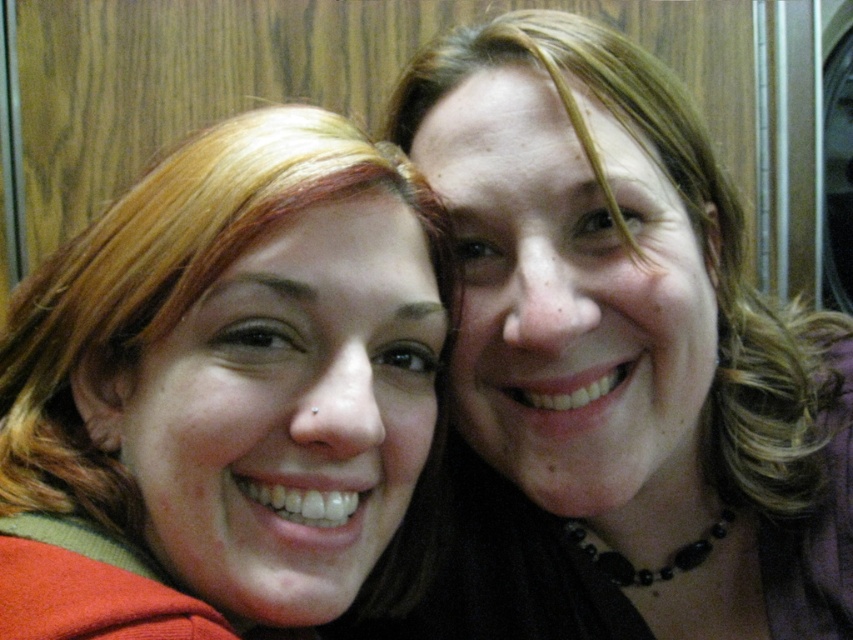
You are a photographer adjusting the camera focus. The smooth black necklace at upper right and the matte red hair at left are both in the frame. Given that the camera has a depth of field that can cover objects within 5 inches of each other, will both objects remain in focus?

The distance between the smooth black necklace at upper right and the matte red hair at left is 5.49 inches. Since the depth of field covers up to 5 inches, the smooth black necklace at upper right and the matte red hair at left will not both be in focus simultaneously.

You are a photographer trying to adjust the lighting for a closeup shot. You need to decide which object is wider to focus on first. Which one is wider between the smooth black necklace at upper right and the matte red hair at left?

The smooth black necklace at upper right might be wider than matte red hair at left, so it should be focused on first if wider.